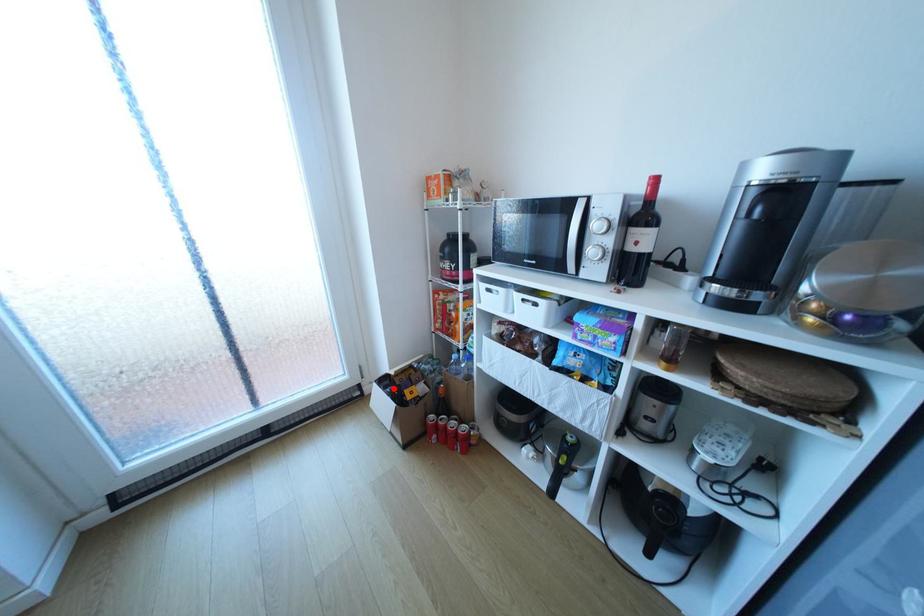
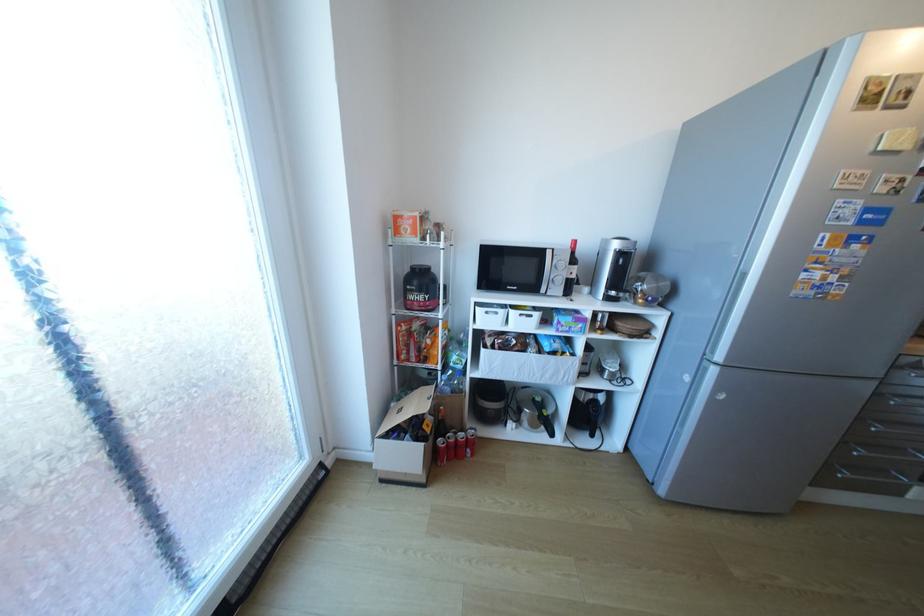
Where in the second image is the point corresponding to the highlighted location from the first image?

(407, 437)